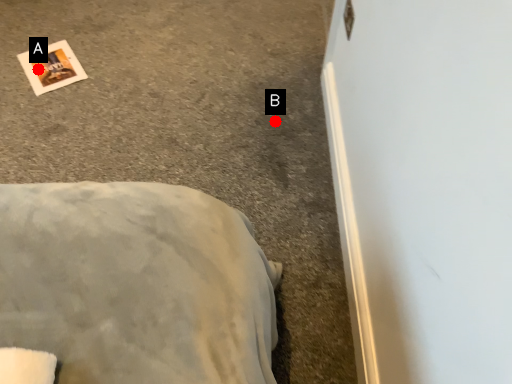
Question: Two points are circled on the image, labeled by A and B beside each circle. Which point is closer to the camera?

Choices:
 (A) A is closer
 (B) B is closer

Answer: (B)